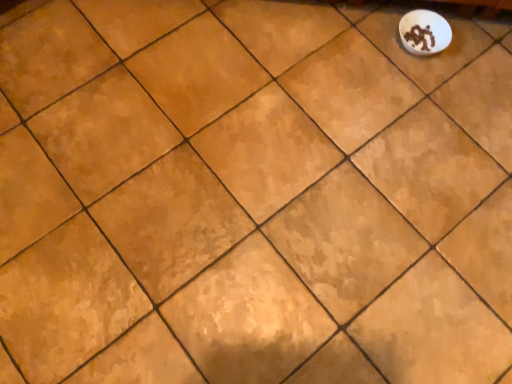
Identify the location of vacant area that is in front of white glossy bowl at upper right. The height and width of the screenshot is (384, 512). (422, 96).